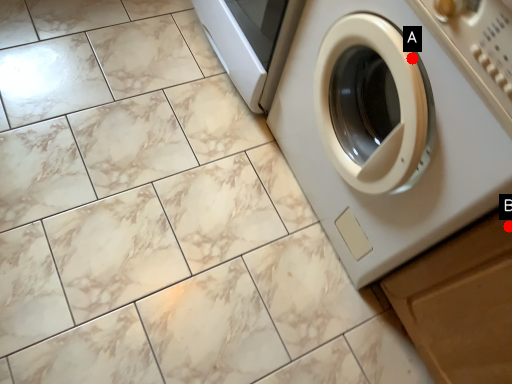
Question: Two points are circled on the image, labeled by A and B beside each circle. Which point appears farthest from the camera in this image?

Choices:
 (A) A is further
 (B) B is further

Answer: (A)